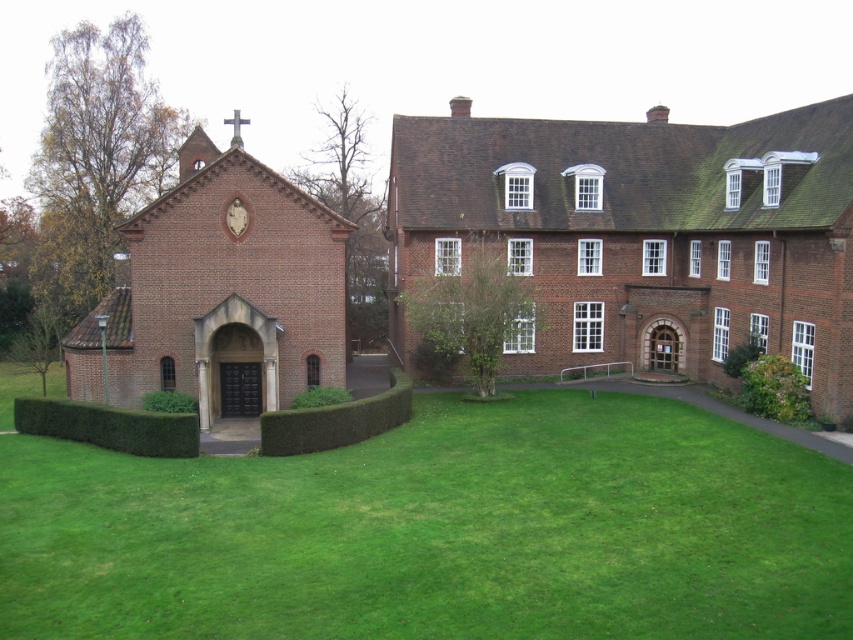
You are planning to install a new pathway in the courtyard. The pathway will be placed between the green grass at lower left and the brown brick building at center. Considering their widths, which area should the pathway be closer to for better balance?

The green grass at lower left has a larger width than the brown brick building at center, so the pathway should be closer to the brown brick building at center to balance the space.

You are standing in the courtyard and want to plant a new tree. The tree requires a space larger than the green grass at lower left. Can the brown brick building at center provide enough space for the tree?

The green grass at lower left is smaller than the brown brick building at center, so the brown brick building at center has enough space to accommodate the tree.

You are an architect planning to add a new structure to the courtyard. You have two options for placement next to the brown brick building at center and the brown brick chapel at left. Considering their sizes, which existing structure should you place the new structure closer to in order to maintain a balanced layout?

The brown brick building at center is larger in size than the brown brick chapel at left, so to maintain a balanced layout, the new structure should be placed closer to the brown brick chapel at left.